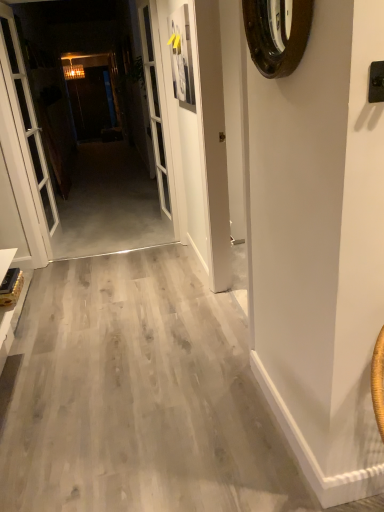
Question: From a real-world perspective, is white glass door at left positioned above or below brown wooden clock at upper right?

Choices:
 (A) below
 (B) above

Answer: (A)

Question: Is white glass door at left wider or thinner than brown wooden clock at upper right?

Choices:
 (A) wide
 (B) thin

Answer: (A)

Question: Estimate the real-world distances between objects in this image. Which object is farther from the concrete floor at center?

Choices:
 (A) brown wooden clock at upper right
 (B) white glass door at left
 (C) white glass screen door at center

Answer: (A)

Question: Based on their relative distances, which object is nearer to the white glass door at left?

Choices:
 (A) brown wooden clock at upper right
 (B) concrete floor at center
 (C) white glass screen door at center

Answer: (B)